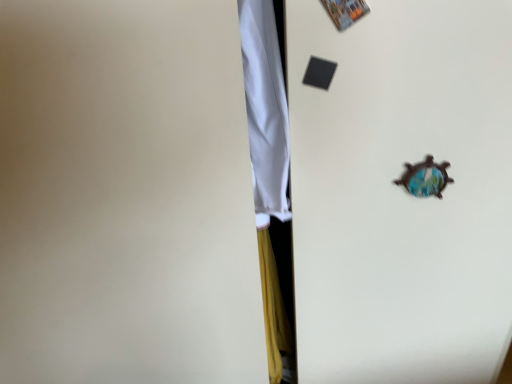
Locate an element on the screen. shiny blue tortoise at upper right is located at coordinates (425, 178).

Describe the element at coordinates (425, 178) in the screenshot. I see `shiny blue tortoise at upper right` at that location.

The width and height of the screenshot is (512, 384). Find the location of `shiny blue tortoise at upper right`. shiny blue tortoise at upper right is located at coordinates (425, 178).